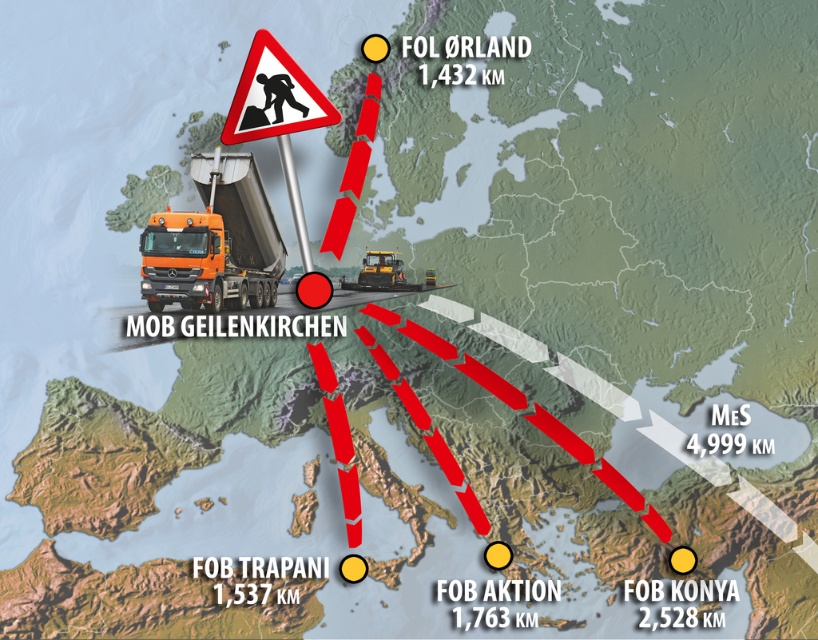
Question: Is orange matte truck at center below red plastic triangle at upper center?

Choices:
 (A) no
 (B) yes

Answer: (B)

Question: Based on their relative distances, which object is farther from the red plastic triangle at upper center?

Choices:
 (A) orange matte truck at center
 (B) red plastic warning sign at upper center

Answer: (A)

Question: Which of these objects is positioned farthest from the red plastic triangle at upper center?

Choices:
 (A) orange matte truck at center
 (B) red plastic warning sign at upper center

Answer: (A)

Question: Is orange matte truck at center thinner than red plastic warning sign at upper center?

Choices:
 (A) yes
 (B) no

Answer: (B)

Question: Is red plastic triangle at upper center in front of red plastic warning sign at upper center?

Choices:
 (A) yes
 (B) no

Answer: (A)

Question: Which object appears closest to the camera in this image?

Choices:
 (A) red plastic warning sign at upper center
 (B) red plastic triangle at upper center
 (C) orange matte truck at center

Answer: (B)